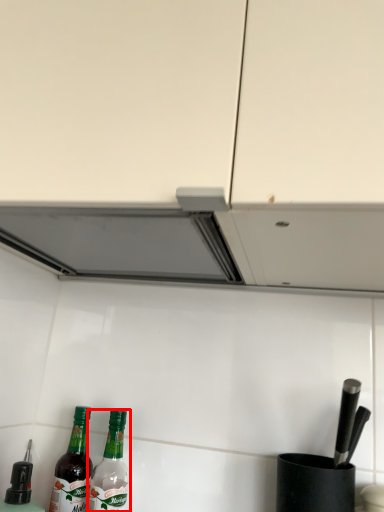
Question: From the image's perspective, where is bottle (annotated by the red box) located in relation to bottle in the image?

Choices:
 (A) above
 (B) below

Answer: (B)